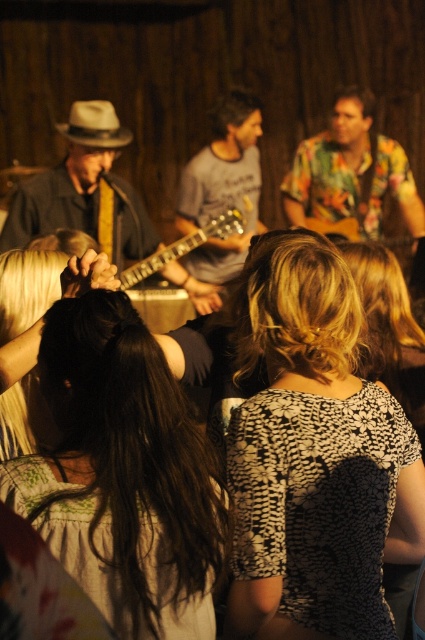
Can you confirm if black printed blouse at center is positioned above white felt cowboy hat at upper left?

No, black printed blouse at center is not above white felt cowboy hat at upper left.

Measure the distance between black printed blouse at center and camera.

black printed blouse at center is 5.85 feet from camera.

Where is `black printed blouse at center`? black printed blouse at center is located at coordinates (314, 456).

Is black printed blouse at center wider than gray t-shirt at center?

Incorrect, black printed blouse at center's width does not surpass gray t-shirt at center's.

Is black printed blouse at center shorter than gray t-shirt at center?

Yes, black printed blouse at center is shorter than gray t-shirt at center.

Is point (342, 572) closer to camera compared to point (244, 188)?

Yes, it is in front of point (244, 188).

Image resolution: width=425 pixels, height=640 pixels. Find the location of `black printed blouse at center`. black printed blouse at center is located at coordinates (314, 456).

Which is behind, point (28, 218) or point (235, 248)?

The point (235, 248) is behind.

Who is more forward, (144,256) or (215,120)?

Point (144,256) is more forward.

Is point (102, 170) positioned in front of point (235, 173)?

That is True.

This screenshot has width=425, height=640. In order to click on matte yellow shirt at left in this screenshot , I will do `click(85, 189)`.